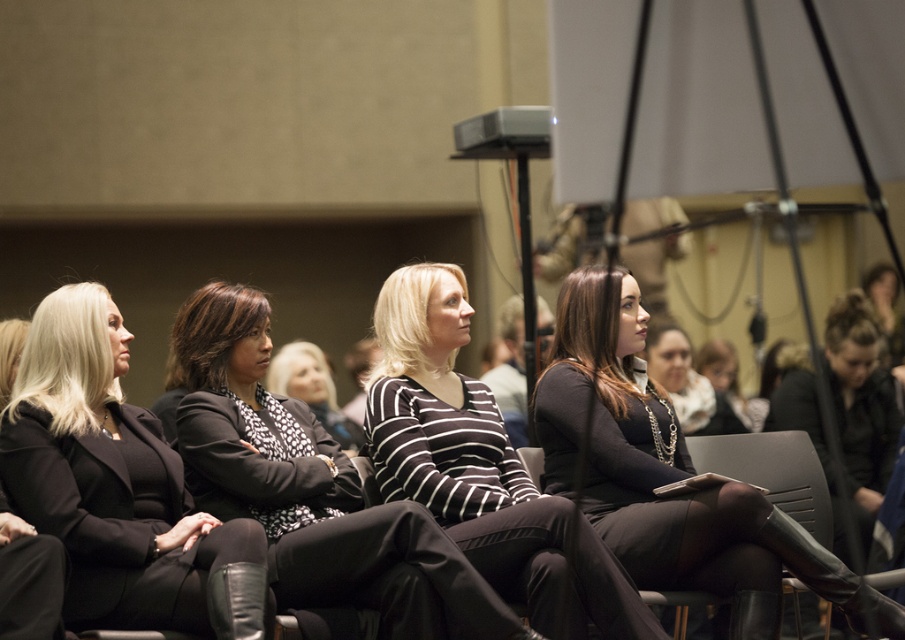
You are organizing a photo shoot and need to ensure that the matte black blazer at center and the striped fabric sweater at center are positioned in a way that they are not too close to each other. Given that the minimum required distance between them is 7 feet, can you confirm if their current positioning meets this requirement?

The matte black blazer at center and striped fabric sweater at center are 7.19 feet apart, which exceeds the minimum required distance of 7 feet. Therefore, their current positioning meets the requirement.

You are organizing a photo shoot and need to place two garments in the center of the frame. You have a matte black blazer at center and a striped fabric sweater at center. Based on their sizes, which garment should you choose if you want to ensure it occupies more space in the photo?

The matte black blazer at center might be wider than striped fabric sweater at center, so the matte black blazer at center should be chosen as it occupies more space in the photo.